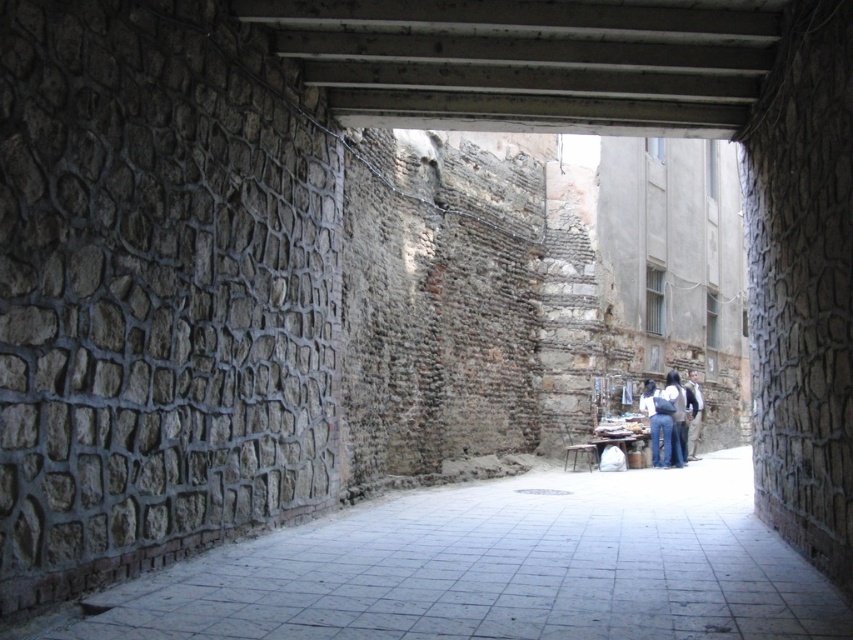
Is point (526, 532) closer to camera compared to point (642, 406)?

Yes, it is.

Is gray stone alley at center above blue jeans at center?

Incorrect, gray stone alley at center is not positioned above blue jeans at center.

Does point (813, 637) lie in front of point (660, 410)?

Yes, it is in front of point (660, 410).

Identify the location of gray stone alley at center. The width and height of the screenshot is (853, 640). (x=497, y=568).

Is dark blue jeans at center closer to camera compared to light brown leather jacket at lower right?

Yes, it is.

Between dark blue jeans at center and light brown leather jacket at lower right, which one appears on the right side from the viewer's perspective?

light brown leather jacket at lower right is more to the right.

Between point (683, 451) and point (697, 413), which one is positioned in front?

Point (683, 451) is more forward.

The height and width of the screenshot is (640, 853). I want to click on dark blue jeans at center, so click(x=676, y=417).

Identify the location of gray stone alley at center. This screenshot has width=853, height=640. (497, 568).

Who is higher up, gray stone alley at center or light brown leather jacket at lower right?

Positioned higher is gray stone alley at center.

Who is more forward, [543,532] or [695,454]?

Point [543,532] is in front.

Identify the location of gray stone alley at center. The image size is (853, 640). (497, 568).